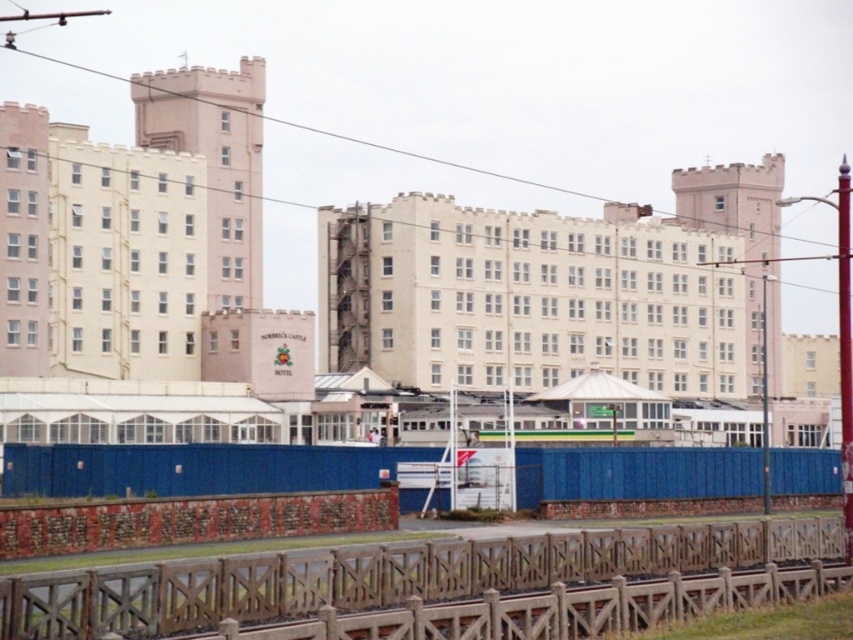
You are a delivery person trying to deliver a package to the wooden at lower center. However, there is a blue plastic fence at lower center blocking your path. Can you walk through the gap between them?

The wooden at lower center is not as tall as the blue plastic fence at lower center, so the gap between them is narrow. You might need to bend down or find an alternative route to avoid hitting your head.

From the picture: You are standing in front of the building complex and want to locate two specific points marked on the structure. The first point is at coordinate point (735, 541) and the second is at point (413, 506). Which of these points is nearer to your current position?

Point (735, 541) is closer to the viewer than point (413, 506), so the first point is nearer to your current position.